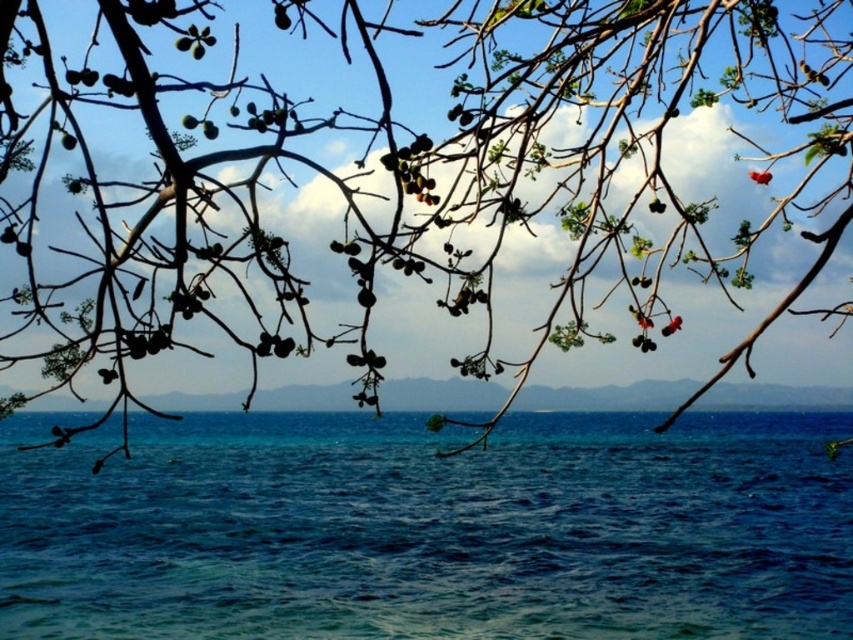
Question: Which of the following is the closest to the observer?

Choices:
 (A) blue liquid water at lower center
 (B) blue matte horizon at center

Answer: (B)

Question: Considering the relative positions of blue liquid water at lower center and blue matte horizon at center in the image provided, where is blue liquid water at lower center located with respect to blue matte horizon at center?

Choices:
 (A) above
 (B) below

Answer: (B)

Question: Is blue liquid water at lower center bigger than green matte leaves at upper center?

Choices:
 (A) yes
 (B) no

Answer: (A)

Question: Which point is closer to the camera taking this photo?

Choices:
 (A) [x=469, y=388]
 (B) [x=590, y=77]

Answer: (B)

Question: Does green matte leaves at upper center appear on the left side of blue matte horizon at center?

Choices:
 (A) yes
 (B) no

Answer: (A)

Question: Which of the following is the closest to the observer?

Choices:
 (A) (625, 112)
 (B) (19, 604)
 (C) (389, 385)

Answer: (A)